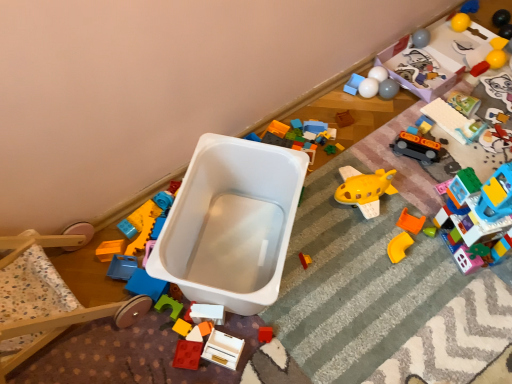
Image resolution: width=512 pixels, height=384 pixels. I want to click on empty space that is in between matte gray cat at upper right, acting as the 2th toy starting from the right, and rubberized red brick at lower center, positioned as the fifteenth toy in right-to-left order, so click(x=393, y=193).